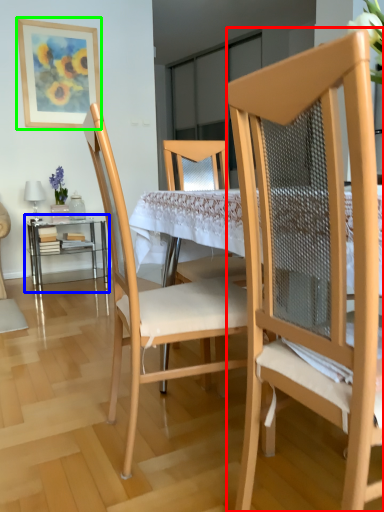
Question: Estimate the real-world distances between objects in this image. Which object is farther from chair (highlighted by a red box), table (highlighted by a blue box) or picture frame (highlighted by a green box)?

Choices:
 (A) table
 (B) picture frame

Answer: (B)